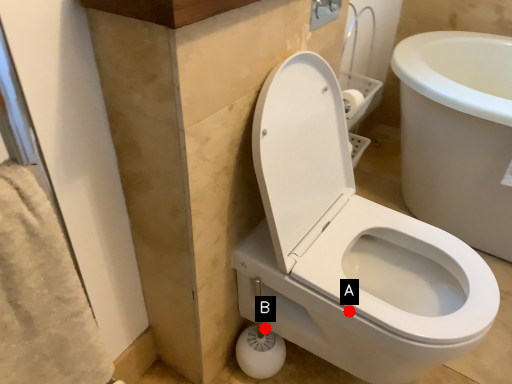
Question: Two points are circled on the image, labeled by A and B beside each circle. Which of the following is the farthest from the observer?

Choices:
 (A) A is further
 (B) B is further

Answer: (B)